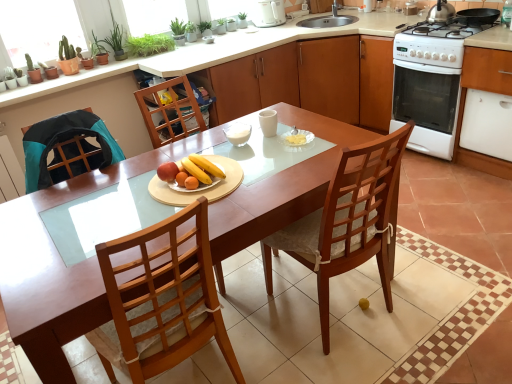
The width and height of the screenshot is (512, 384). Identify the location of vacant space to the left of yellow matte bananas at center, the first fruit dish from the right. (139, 193).